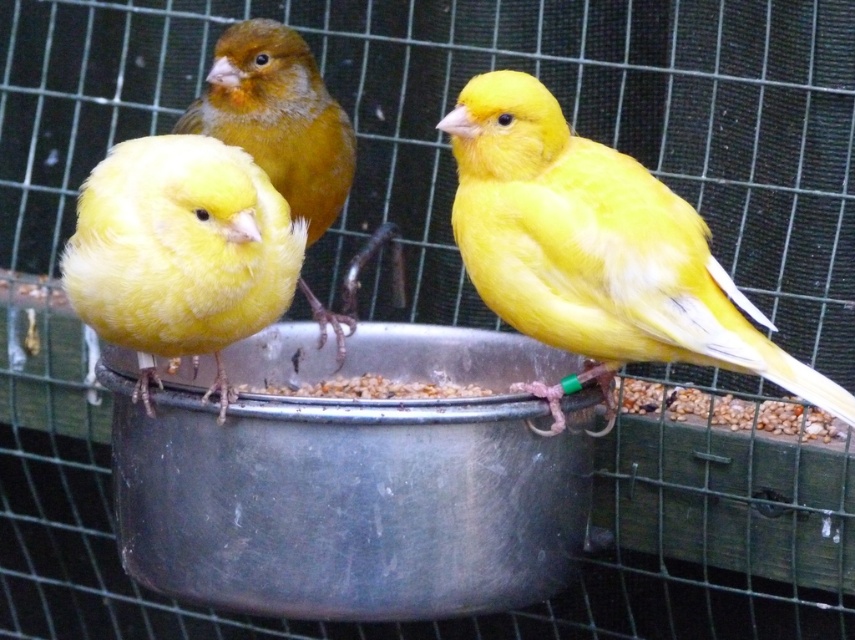
You are a small toy bird that is 2 inches in length. You want to fly from the yellow matte bird at center to the matte yellow canary at left. Can you land safely between them without hitting any obstacles?

The yellow matte bird at center is 12.86 inches away from the matte yellow canary at left. Since the distance between them is more than twice your length, you can safely land between them without any obstacles.

You are a bird enthusiast observing the three canaries in the birdcage. You notice two birds labeled as the matte yellow canary at center and the yellow matte bird at center. Which one is positioned to the right of the other?

The matte yellow canary at center is positioned to the right of the yellow matte bird at center.

You are a bird enthusiast observing the three canaries in the birdcage. You notice the matte yellow canary at center and the matte yellow canary at left. Based on their positions, which canary is closer to the feeding dish located at the bottom of the cage?

The matte yellow canary at left is closer to the feeding dish located at the bottom of the cage since it is positioned to the left of the matte yellow canary at center, which is further to the right.